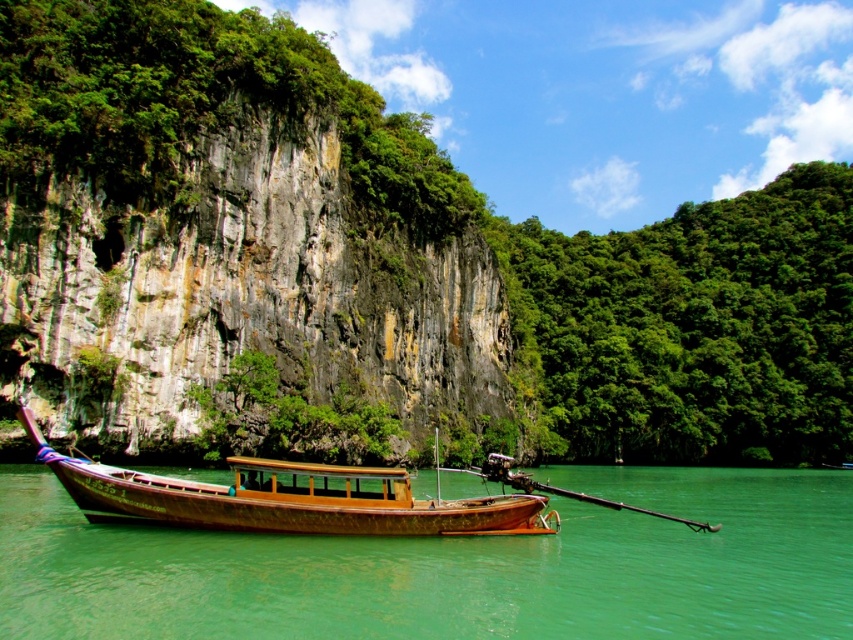
Question: Among these objects, which one is farthest from the camera?

Choices:
 (A) wooden boat at center
 (B) green water at boat center

Answer: (A)

Question: Can you confirm if green water at boat center is smaller than wooden boat at center?

Choices:
 (A) yes
 (B) no

Answer: (B)

Question: Among these objects, which one is nearest to the camera?

Choices:
 (A) green water at boat center
 (B) wooden boat at center

Answer: (A)

Question: Does green water at boat center have a greater width compared to wooden boat at center?

Choices:
 (A) yes
 (B) no

Answer: (A)

Question: Among these objects, which one is nearest to the camera?

Choices:
 (A) green water at boat center
 (B) wooden boat at center

Answer: (A)

Question: Does green water at boat center lie behind wooden boat at center?

Choices:
 (A) yes
 (B) no

Answer: (B)